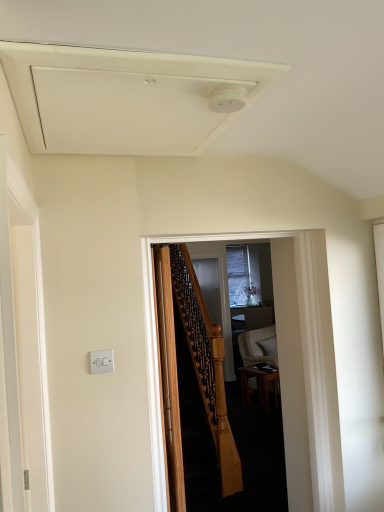
Question: Is wooden door at center in front of or behind clear glass screen door at center, the 2th screen door positioned from the left, in the image?

Choices:
 (A) behind
 (B) front

Answer: (B)

Question: In terms of height, does wooden door at center look taller or shorter compared to clear glass screen door at center, marked as the 2th screen door in a front-to-back arrangement?

Choices:
 (A) short
 (B) tall

Answer: (A)

Question: Which object is positioned farthest from the wooden door at center?

Choices:
 (A) white plastic switch at lower left
 (B) clear glass screen door at center, acting as the first screen door starting from the right
 (C) white matte exhaust hood at upper center
 (D) white plastic switch at left, which is counted as the 1th screen door, starting from the front
 (E) wooden staircase at center

Answer: (B)

Question: Which object is the farthest from the wooden staircase at center?

Choices:
 (A) white plastic switch at left, which is the second screen door from back to front
 (B) wooden door at center
 (C) white matte exhaust hood at upper center
 (D) wooden table at center
 (E) white plastic switch at lower left

Answer: (D)